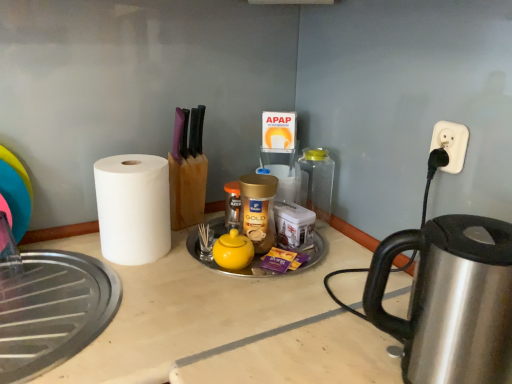
Question: Is transparent glass jar at center wider or thinner than yellow matte tea pot at center?

Choices:
 (A) thin
 (B) wide

Answer: (A)

Question: From a real-world perspective, is transparent glass jar at center physically located above or below yellow matte tea pot at center?

Choices:
 (A) below
 (B) above

Answer: (B)

Question: Which object is positioned farthest from the white plastic outlet at upper right?

Choices:
 (A) transparent glass jar at center
 (B) yellow matte tea pot at center
 (C) white matte paper towel at left
 (D) satin silver kettle at right

Answer: (C)

Question: Based on their relative distances, which object is farther from the satin silver kettle at right?

Choices:
 (A) white plastic outlet at upper right
 (B) white matte paper towel at left
 (C) yellow matte tea pot at center
 (D) transparent glass jar at center

Answer: (D)